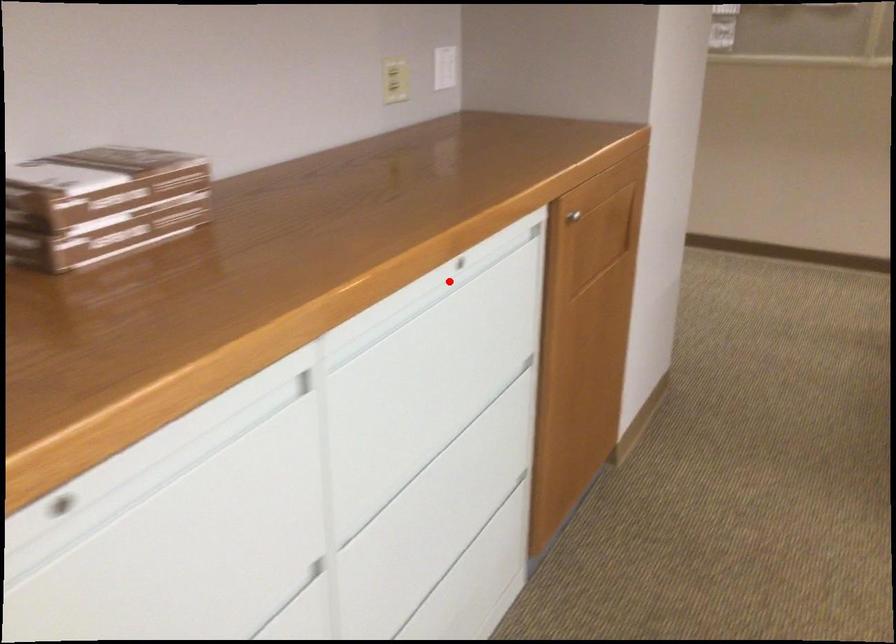
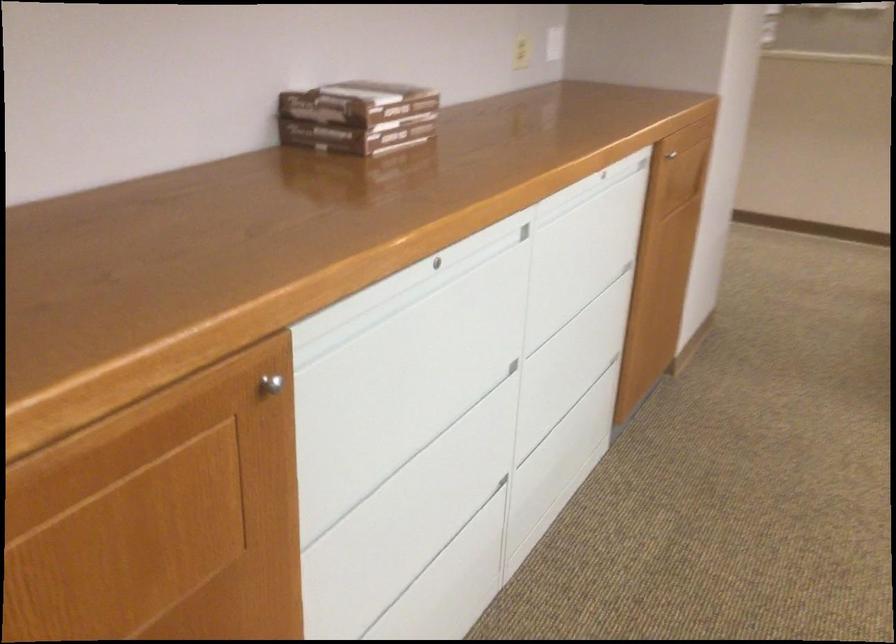
Question: A red point is marked in image1. In image2, is the corresponding 3D point closer to the camera or farther? Reply with the corresponding letter.

Choices:
 (A) The corresponding 3D point is closer.
 (B) The corresponding 3D point is farther.

Answer: (B)